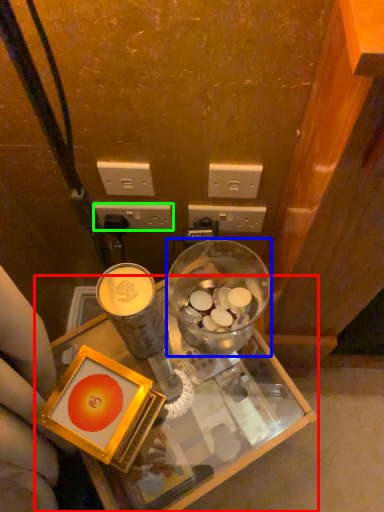
Question: Which is farther away from desk (highlighted by a red box)? tableware (highlighted by a blue box) or power outlet (highlighted by a green box)?

Choices:
 (A) tableware
 (B) power outlet

Answer: (B)